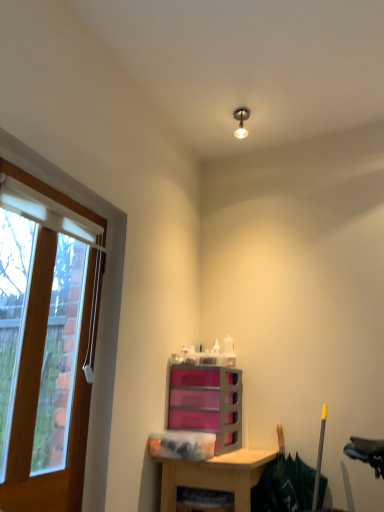
Question: Is pink plastic drawers at center located outside metallic bulb at upper center?

Choices:
 (A) no
 (B) yes

Answer: (B)

Question: Is pink plastic drawers at center far from metallic bulb at upper center?

Choices:
 (A) no
 (B) yes

Answer: (B)

Question: From a real-world perspective, is pink plastic drawers at center below metallic bulb at upper center?

Choices:
 (A) yes
 (B) no

Answer: (A)

Question: Considering the relative positions of pink plastic drawers at center and metallic bulb at upper center in the image provided, is pink plastic drawers at center behind metallic bulb at upper center?

Choices:
 (A) no
 (B) yes

Answer: (A)

Question: Can you confirm if pink plastic drawers at center is smaller than metallic bulb at upper center?

Choices:
 (A) yes
 (B) no

Answer: (B)

Question: From a real-world perspective, is pink plastic drawers at center positioned above or below metallic bulb at upper center?

Choices:
 (A) below
 (B) above

Answer: (A)

Question: Considering the positions of pink plastic drawers at center and metallic bulb at upper center in the image, is pink plastic drawers at center taller or shorter than metallic bulb at upper center?

Choices:
 (A) tall
 (B) short

Answer: (A)

Question: In the image, is pink plastic drawers at center on the left side or the right side of metallic bulb at upper center?

Choices:
 (A) right
 (B) left

Answer: (B)

Question: Relative to metallic bulb at upper center, is pink plastic drawers at center in front or behind?

Choices:
 (A) behind
 (B) front

Answer: (B)

Question: Which is correct: wooden desk at lower center is inside metallic bulb at upper center, or outside of it?

Choices:
 (A) outside
 (B) inside

Answer: (A)

Question: From the image's perspective, is wooden desk at lower center above or below metallic bulb at upper center?

Choices:
 (A) above
 (B) below

Answer: (B)

Question: Is wooden desk at lower center wider or thinner than metallic bulb at upper center?

Choices:
 (A) wide
 (B) thin

Answer: (A)

Question: Considering the positions of wooden desk at lower center and metallic bulb at upper center in the image, is wooden desk at lower center taller or shorter than metallic bulb at upper center?

Choices:
 (A) tall
 (B) short

Answer: (A)

Question: Considering the relative positions of wooden frame at left and metallic bulb at upper center in the image provided, is wooden frame at left to the left or to the right of metallic bulb at upper center?

Choices:
 (A) left
 (B) right

Answer: (A)

Question: From the image's perspective, is wooden frame at left located above or below metallic bulb at upper center?

Choices:
 (A) above
 (B) below

Answer: (B)